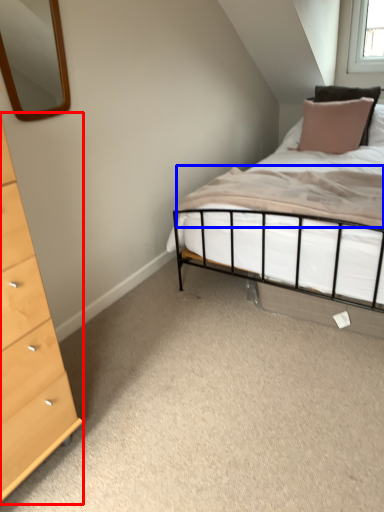
Question: Among these objects, which one is nearest to the camera, chest of drawers (highlighted by a red box) or mattress (highlighted by a blue box)?

Choices:
 (A) chest of drawers
 (B) mattress

Answer: (A)